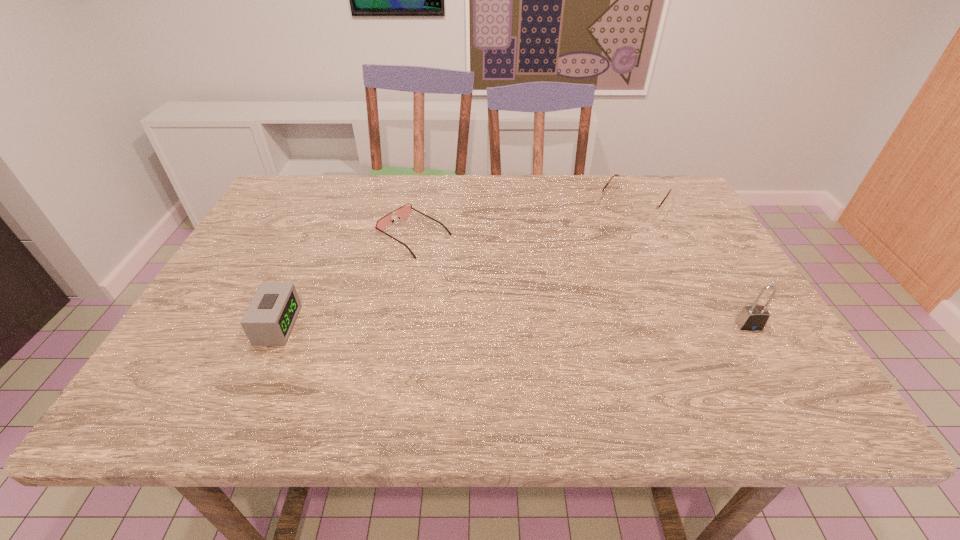
Identify the location of vacant space located 0.320m on the bridge of the sunglasses. (547, 310).

I want to click on free space located on the bridge of the sunglasses, so click(507, 288).

At what (x,y) coordinates should I click in order to perform the action: click on free location located on the bridge of the sunglasses. Please return your answer as a coordinate pair (x, y). Looking at the image, I should click on (459, 260).

Where is `spectacles situated at the far edge`? spectacles situated at the far edge is located at coordinates (640, 210).

Identify the location of sunglasses present at the far edge. The image size is (960, 540). (403, 211).

I want to click on object located at the near edge, so click(271, 315).

This screenshot has width=960, height=540. I want to click on object that is at the left edge, so click(x=271, y=315).

You are a GUI agent. You are given a task and a screenshot of the screen. Output one action in this format:
    pyautogui.click(x=<x>, y=<y>)
    Task: Click on the padlock that is at the right edge
    
    Given the screenshot: What is the action you would take?
    pyautogui.click(x=754, y=317)

Locate an element on the screen. The image size is (960, 540). spectacles that is at the right edge is located at coordinates (640, 210).

This screenshot has width=960, height=540. Find the location of `object that is at the near left corner`. object that is at the near left corner is located at coordinates (271, 315).